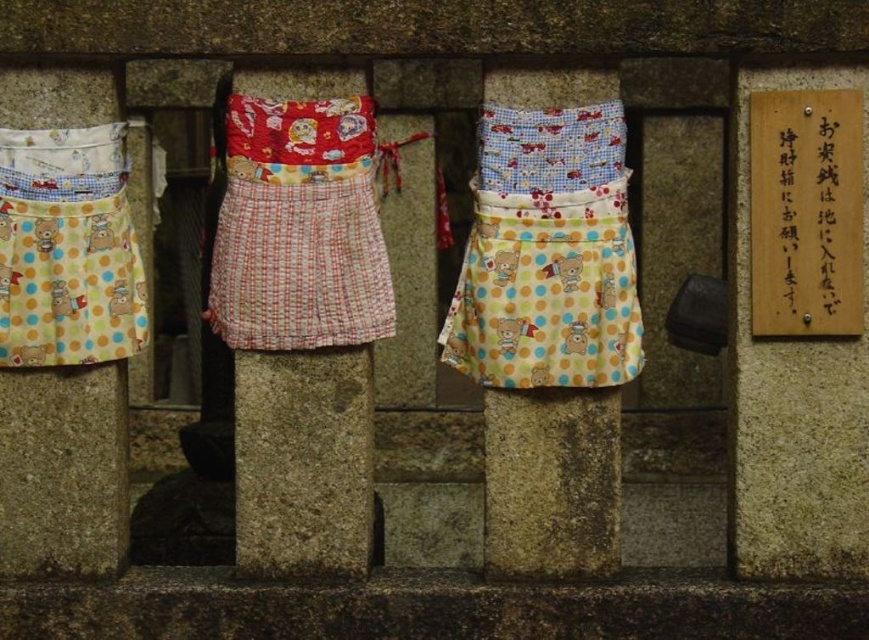
Which is above, yellow polka dot fabric apron at center or wooden sign at upper right?

wooden sign at upper right is higher up.

The width and height of the screenshot is (869, 640). I want to click on yellow polka dot fabric apron at center, so click(x=551, y=483).

Between point (264, 144) and point (96, 362), which one is positioned in front?

Point (264, 144)

Is red plaid apron at center to the right of matte yellow fabric dress at left from the viewer's perspective?

Correct, you'll find red plaid apron at center to the right of matte yellow fabric dress at left.

The width and height of the screenshot is (869, 640). Find the location of `red plaid apron at center`. red plaid apron at center is located at coordinates (299, 228).

Does matte yellow fabric dress at left appear on the left side of yellow polka dot fabric apron at center?

Correct, you'll find matte yellow fabric dress at left to the left of yellow polka dot fabric apron at center.

Which is in front, point (14, 232) or point (514, 454)?

Point (14, 232)

Between point (3, 193) and point (526, 74), which one is positioned behind?

The point (3, 193) is more distant.

Locate an element on the screen. Image resolution: width=869 pixels, height=640 pixels. matte yellow fabric dress at left is located at coordinates (67, 250).